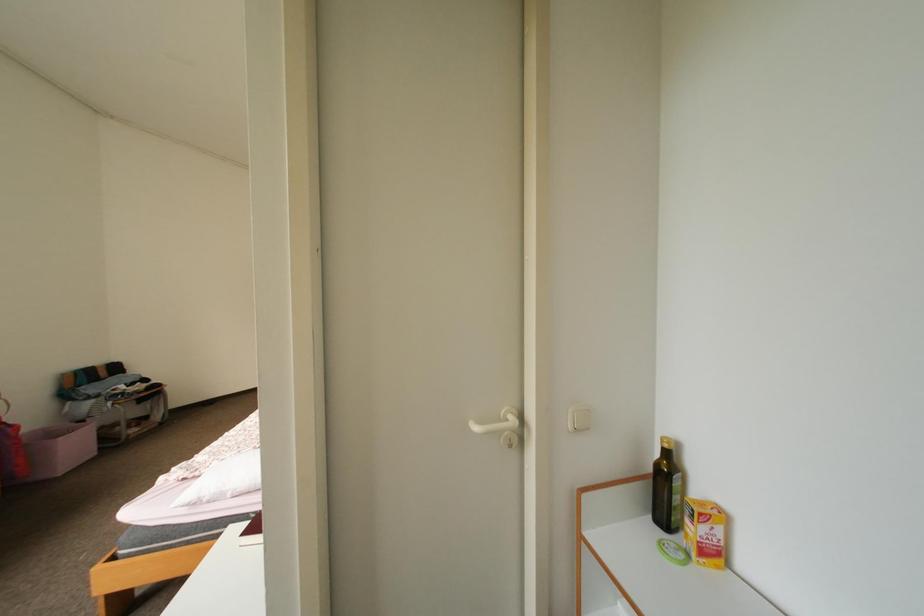
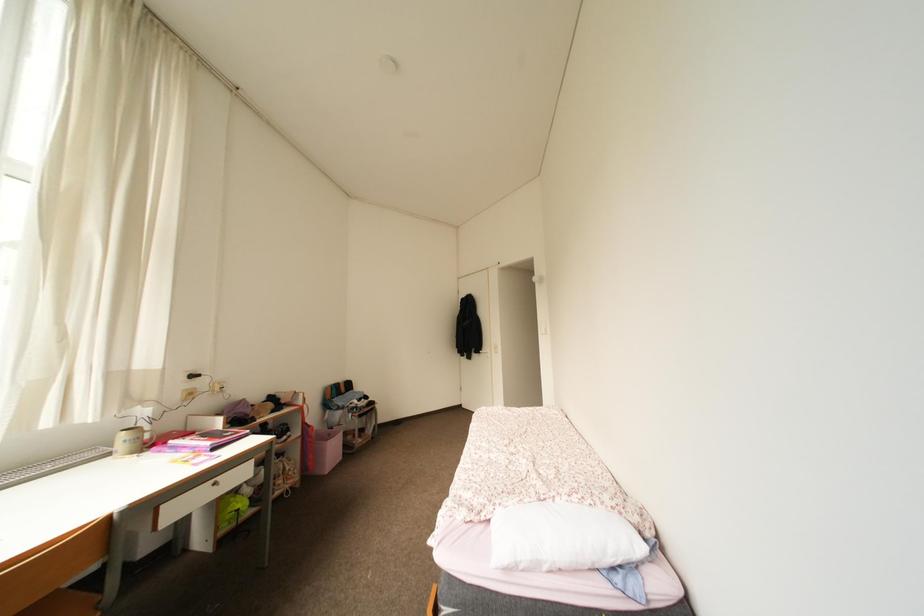
Question: What movement of the cameraman would produce the second image?

Choices:
 (A) Left
 (B) Right
 (C) Forward
 (D) Backward

Answer: (A)